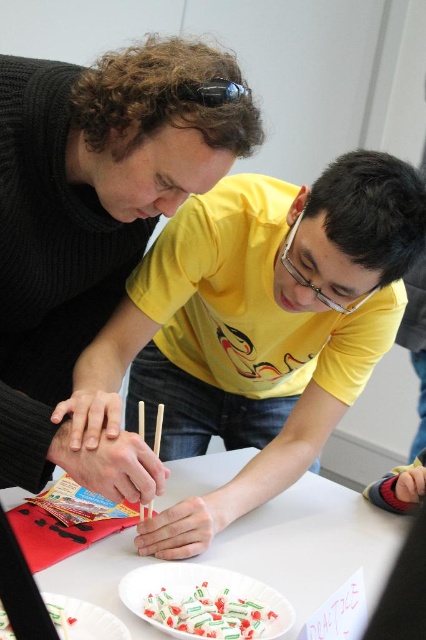
You are a photographer setting up a shoot at this table. You need to place a small prop between the black matte shirt at center and the white glossy candy at lower center. Based on their positions, which object should the prop be closer to?

The prop should be placed closer to the white glossy candy at lower center because the black matte shirt at center is taller than the white glossy candy at lower center, meaning the candy is positioned lower on the table.

You are a person sitting at the table in the scene. You want to place a small decorative item exactly halfway between the point at coordinates point [92,129] and the point at coordinates point [218,611]. Where would you place it?

The halfway point between point [92,129] and point [218,611] would be at coordinates calculated by averaging their x and y values. The midpoint is at x coordinate 0.579 and y coordinate 0.365. Therefore, you should place the decorative item at the midpoint coordinates of 0.579, 0.365.